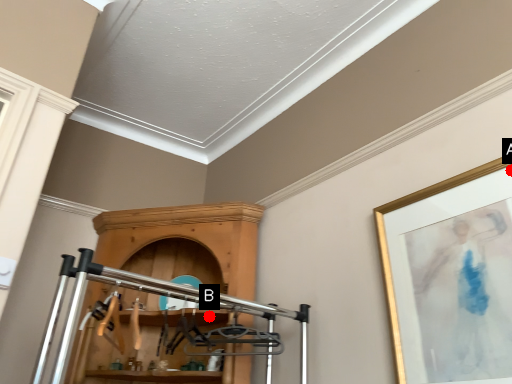
Question: Two points are circled on the image, labeled by A and B beside each circle. Which point is closer to the camera?

Choices:
 (A) A is closer
 (B) B is closer

Answer: (A)